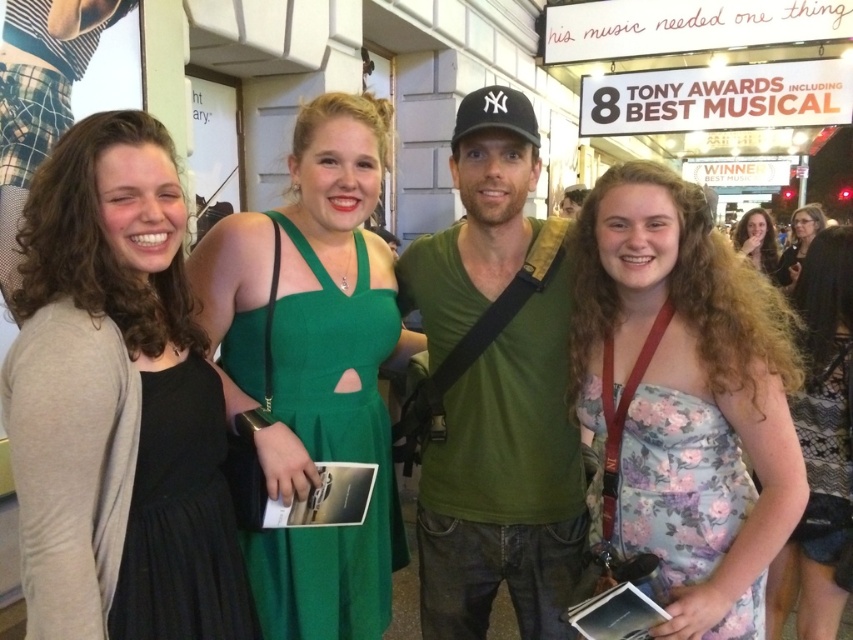
Question: Does green satin dress at center have a greater width compared to floral chiffon dress at center?

Choices:
 (A) yes
 (B) no

Answer: (A)

Question: Which of these objects is positioned closest to the green cotton shirt at center?

Choices:
 (A) floral fabric dress at center
 (B) green satin dress at center

Answer: (B)

Question: Does black satin dress at left have a greater width compared to floral fabric dress at center?

Choices:
 (A) no
 (B) yes

Answer: (A)

Question: Which object is the farthest from the green cotton shirt at center?

Choices:
 (A) green satin dress at center
 (B) black satin dress at left
 (C) matte black dress at upper right

Answer: (C)

Question: Can you confirm if floral print dress at center is positioned below green cotton shirt at center?

Choices:
 (A) yes
 (B) no

Answer: (A)

Question: Among these points, which one is farthest from the camera?

Choices:
 (A) (811, 237)
 (B) (846, 284)

Answer: (A)